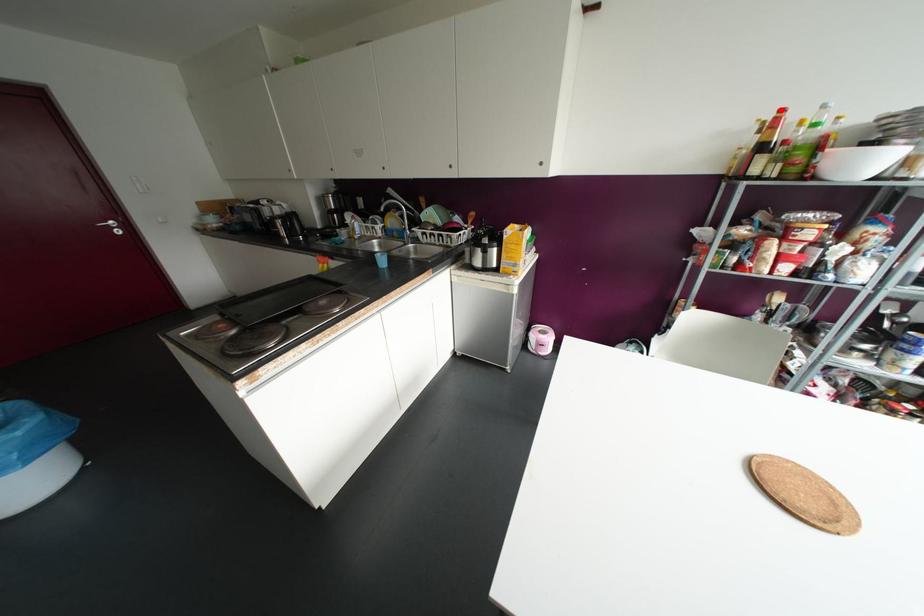
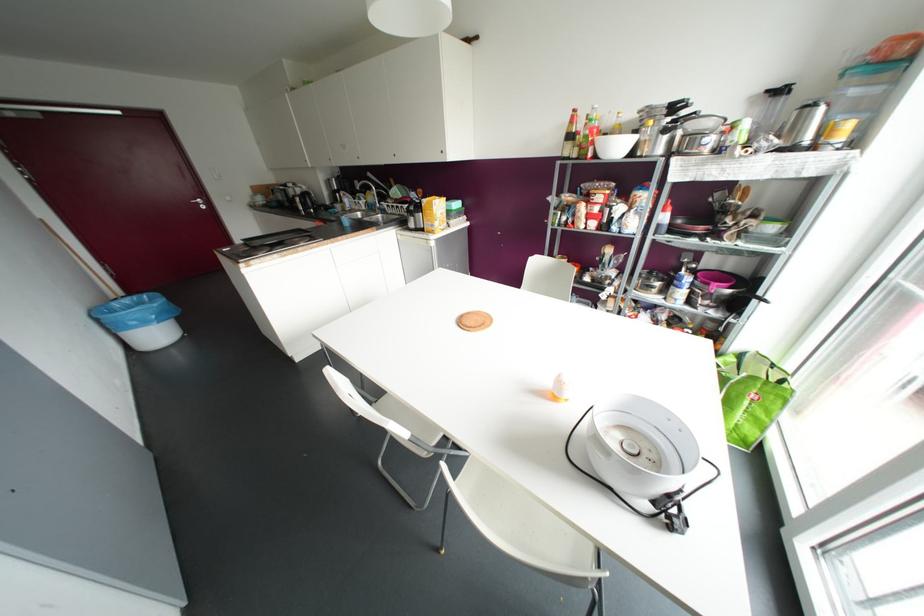
In the second image, find the point that corresponds to the highlighted location in the first image.

(574, 110)